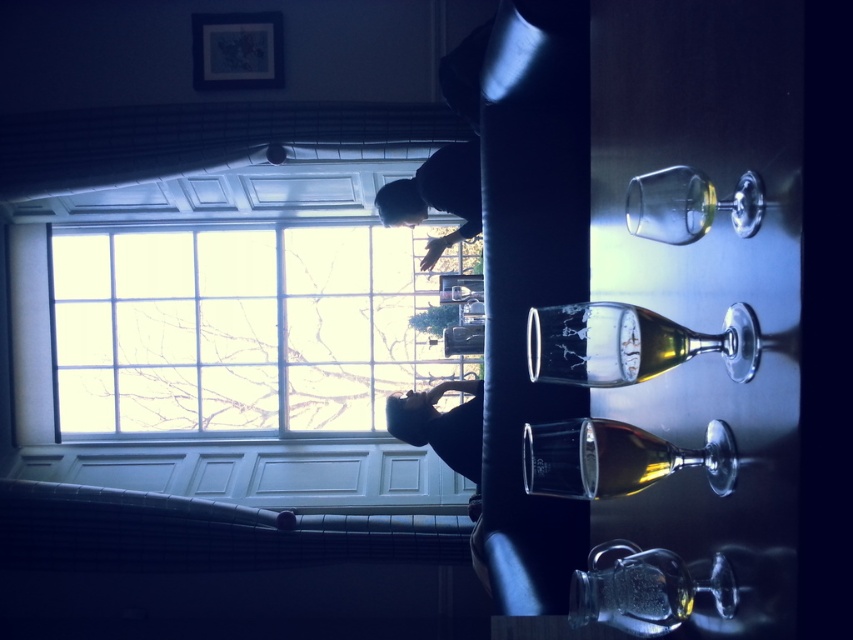
Question: Which point is closer to the camera taking this photo?

Choices:
 (A) (482, 342)
 (B) (625, 332)
 (C) (689, 593)
 (D) (657, 442)

Answer: (B)

Question: Which point is farther from the camera taking this photo?

Choices:
 (A) (645, 192)
 (B) (93, 282)
 (C) (651, 480)

Answer: (B)

Question: Can you confirm if translucent glass wine bottle at center is wider than translucent glass bottle at center?

Choices:
 (A) no
 (B) yes

Answer: (B)

Question: Which object is closer to the camera taking this photo?

Choices:
 (A) clear glass wine glass at lower center
 (B) translucent glass wine bottle at center
 (C) translucent glass bottle at center
 (D) transparent glass at upper right

Answer: (B)

Question: Is the position of transparent glass wine bottle at center less distant than that of transparent glass at upper right?

Choices:
 (A) no
 (B) yes

Answer: (A)

Question: Does clear glass wine glass at lower center have a lesser width compared to translucent glass bottle at center?

Choices:
 (A) yes
 (B) no

Answer: (B)